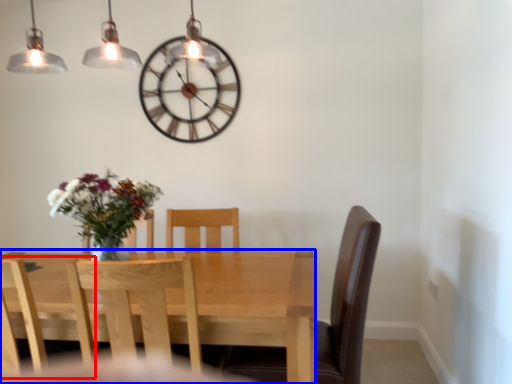
Question: Among these objects, which one is nearest to the camera, chair (highlighted by a red box) or kitchen & dining room table (highlighted by a blue box)?

Choices:
 (A) chair
 (B) kitchen & dining room table

Answer: (B)